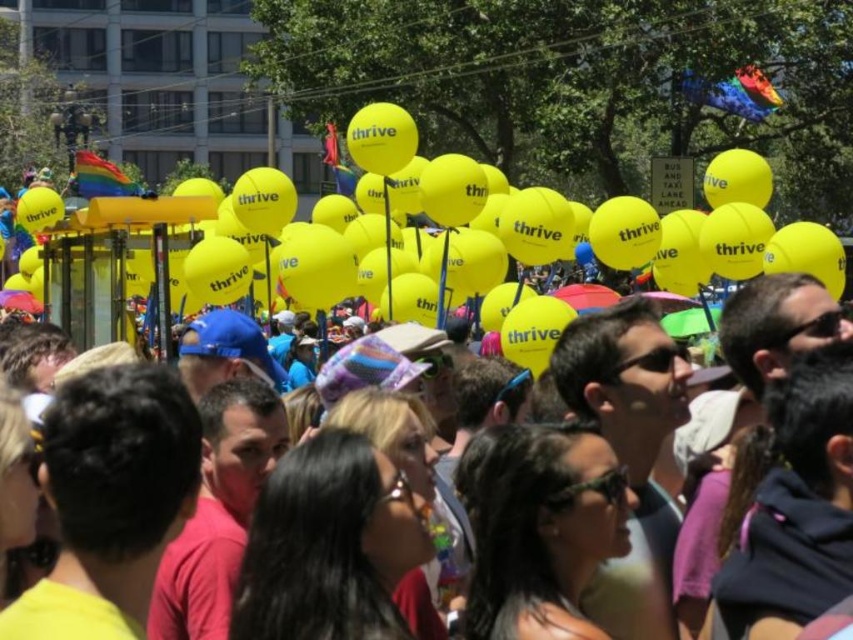
You are standing at the center of the scene and want to walk towards the point labeled as point (424, 333). There is an obstacle at point (424, 198). Will you encounter the obstacle before reaching your destination?

Since point (424, 198) is behind point (424, 333), you will not encounter the obstacle before reaching your destination.

From the picture: You are a photographer at the event and want to capture the yellow matte balloon at upper center and the yellow matte balloons at upper center in a single shot. Which object will appear wider in the photo?

The yellow matte balloon at upper center will appear wider in the photo because its width surpasses that of the yellow matte balloons at upper center.